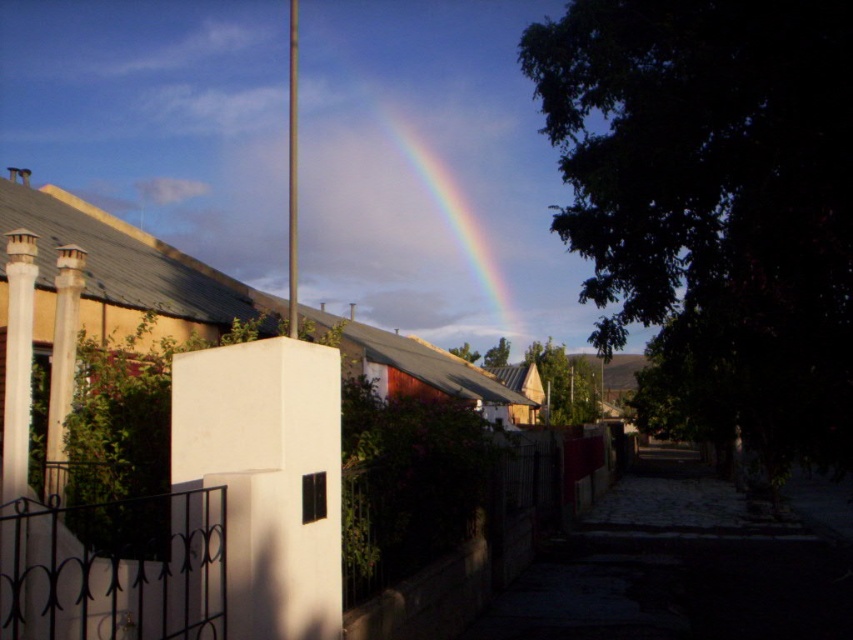
You are a city planner analyzing the urban layout. Given the white matte pillar at center and the rainbow at upper center, which object appears narrower from your vantage point?

The white matte pillar at center appears narrower than the rainbow at upper center because it has a lesser width according to the description.